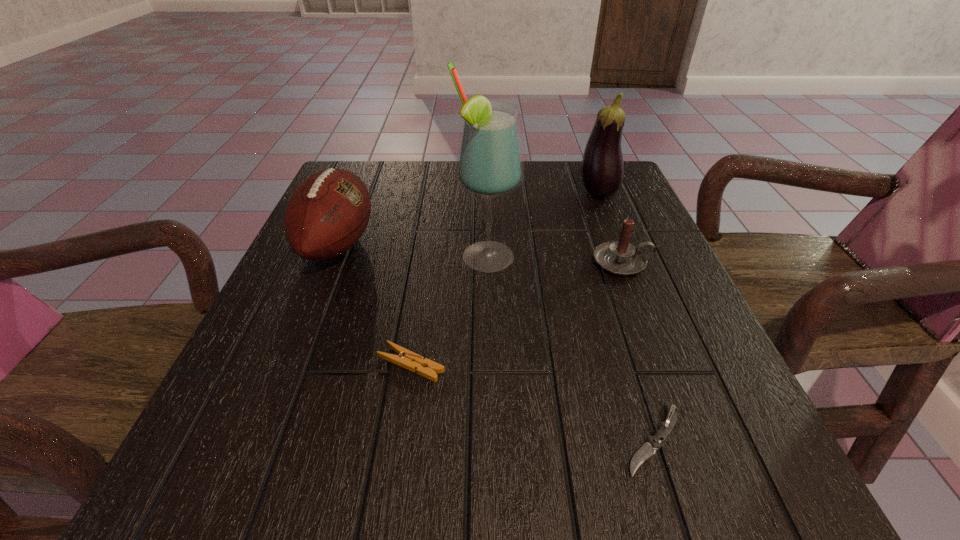
Identify which object is located as the third nearest to the fourth tallest object. Please provide its 2D coordinates. Your answer should be formatted as a tuple, i.e. [(x, y)], where the tuple contains the x and y coordinates of a point satisfying the conditions above.

[(648, 449)]